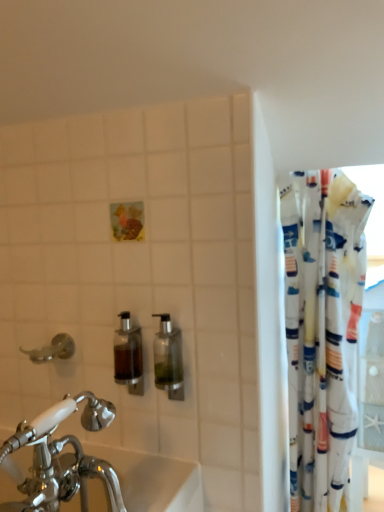
The width and height of the screenshot is (384, 512). Describe the element at coordinates (62, 458) in the screenshot. I see `chrome metallic faucet at lower left` at that location.

Where is `white fabric curtain at right`? This screenshot has height=512, width=384. white fabric curtain at right is located at coordinates (322, 330).

I want to click on clear glass soap dispenser at center, which is the first soap dispenser in right-to-left order, so click(168, 358).

Identify the location of plumbing fixture below the translucent glass soap dispenser at center, acting as the second soap dispenser starting from the right (from the image's perspective). (53, 349).

From a real-world perspective, relative to translucent glass soap dispenser at center, acting as the second soap dispenser starting from the right, is brushed metal faucet at left vertically above or below?

brushed metal faucet at left is below translucent glass soap dispenser at center, acting as the second soap dispenser starting from the right.

Looking at this image, can you confirm if brushed metal faucet at left is thinner than translucent glass soap dispenser at center, acting as the second soap dispenser starting from the right?

No, brushed metal faucet at left is not thinner than translucent glass soap dispenser at center, acting as the second soap dispenser starting from the right.

Who is smaller, translucent glass soap dispenser at center, the 1th soap dispenser viewed from the left, or chrome metallic faucet at lower left?

translucent glass soap dispenser at center, the 1th soap dispenser viewed from the left, is smaller.

Is translucent glass soap dispenser at center, the 1th soap dispenser viewed from the left, not within chrome metallic faucet at lower left?

Yes, translucent glass soap dispenser at center, the 1th soap dispenser viewed from the left, is located beyond the bounds of chrome metallic faucet at lower left.

Can you confirm if brushed metal faucet at left is wider than chrome metallic faucet at lower left?

No, brushed metal faucet at left is not wider than chrome metallic faucet at lower left.

From the picture: Is brushed metal faucet at left in contact with chrome metallic faucet at lower left?

No, brushed metal faucet at left is not next to chrome metallic faucet at lower left.

Is brushed metal faucet at left positioned in front of chrome metallic faucet at lower left?

That is False.

Find the location of a particular element. This screenshot has width=384, height=512. soap dispenser behind the clear glass soap dispenser at center, arranged as the second soap dispenser when viewed from the left is located at coordinates (128, 355).

Is clear glass soap dispenser at center, which is the first soap dispenser in right-to-left order, wider than translucent glass soap dispenser at center, the 1th soap dispenser viewed from the left?

Correct, the width of clear glass soap dispenser at center, which is the first soap dispenser in right-to-left order, exceeds that of translucent glass soap dispenser at center, the 1th soap dispenser viewed from the left.

Would you consider clear glass soap dispenser at center, which is the first soap dispenser in right-to-left order, to be distant from translucent glass soap dispenser at center, the 1th soap dispenser viewed from the left?

clear glass soap dispenser at center, which is the first soap dispenser in right-to-left order, is actually quite close to translucent glass soap dispenser at center, the 1th soap dispenser viewed from the left.

Which object is further away from the camera, clear glass soap dispenser at center, which is the first soap dispenser in right-to-left order, or translucent glass soap dispenser at center, acting as the second soap dispenser starting from the right?

translucent glass soap dispenser at center, acting as the second soap dispenser starting from the right, is further from the camera.

Which object is positioned more to the left, white fabric curtain at right or translucent glass soap dispenser at center, acting as the second soap dispenser starting from the right?

Positioned to the left is translucent glass soap dispenser at center, acting as the second soap dispenser starting from the right.

From a real-world perspective, is white fabric curtain at right located higher than translucent glass soap dispenser at center, the 1th soap dispenser viewed from the left?

No, from a real-world perspective, white fabric curtain at right is not over translucent glass soap dispenser at center, the 1th soap dispenser viewed from the left

Which of these two, white fabric curtain at right or translucent glass soap dispenser at center, acting as the second soap dispenser starting from the right, stands taller?

Standing taller between the two is white fabric curtain at right.

Can you see white fabric curtain at right touching translucent glass soap dispenser at center, acting as the second soap dispenser starting from the right?

No, white fabric curtain at right is not next to translucent glass soap dispenser at center, acting as the second soap dispenser starting from the right.

How many degrees apart are the facing directions of brushed metal faucet at left and white fabric curtain at right?

They differ by 0.759 degrees in their facing directions.

Considering the relative sizes of brushed metal faucet at left and white fabric curtain at right in the image provided, is brushed metal faucet at left smaller than white fabric curtain at right?

Yes, brushed metal faucet at left is smaller than white fabric curtain at right.

From the image's perspective, between brushed metal faucet at left and white fabric curtain at right, which one is located above?

→ From the image's view, brushed metal faucet at left is above.

Based on their positions, is brushed metal faucet at left located to the left or right of white fabric curtain at right?

From the image, it's evident that brushed metal faucet at left is to the left of white fabric curtain at right.

The width and height of the screenshot is (384, 512). In order to click on soap dispenser that is the 1st object located in front of the white fabric curtain at right in this screenshot , I will do `click(128, 355)`.

Is there a large distance between translucent glass soap dispenser at center, acting as the second soap dispenser starting from the right, and white fabric curtain at right?

Actually, translucent glass soap dispenser at center, acting as the second soap dispenser starting from the right, and white fabric curtain at right are a little close together.

Looking at this image, from the image's perspective, is translucent glass soap dispenser at center, acting as the second soap dispenser starting from the right, located beneath white fabric curtain at right?

No, from the image's perspective, translucent glass soap dispenser at center, acting as the second soap dispenser starting from the right, is not beneath white fabric curtain at right.

Is point (118, 359) more distant than point (359, 240)?

That is False.

Find the location of a particular element. the 1st soap dispenser in front of the brushed metal faucet at left, starting your count from the anchor is located at coordinates (128, 355).

This screenshot has width=384, height=512. In order to click on tap located on the left of translucent glass soap dispenser at center, the 1th soap dispenser viewed from the left in this screenshot , I will do `click(62, 458)`.

Which object lies further to the anchor point brushed metal faucet at left, white fabric curtain at right or clear glass soap dispenser at center, which is the first soap dispenser in right-to-left order?

white fabric curtain at right is positioned further to the anchor brushed metal faucet at left.

From the image, which object appears to be farther from clear glass soap dispenser at center, arranged as the second soap dispenser when viewed from the left, chrome metallic faucet at lower left or brushed metal faucet at left?

brushed metal faucet at left lies further to clear glass soap dispenser at center, arranged as the second soap dispenser when viewed from the left, than the other object.

When comparing their distances from translucent glass soap dispenser at center, acting as the second soap dispenser starting from the right, does brushed metal faucet at left or chrome metallic faucet at lower left seem closer?

The object closer to translucent glass soap dispenser at center, acting as the second soap dispenser starting from the right, is brushed metal faucet at left.

Considering their positions, is translucent glass soap dispenser at center, the 1th soap dispenser viewed from the left, positioned further to chrome metallic faucet at lower left than white fabric curtain at right?

white fabric curtain at right lies further to chrome metallic faucet at lower left than the other object.

Based on their spatial positions, is white fabric curtain at right or brushed metal faucet at left closer to chrome metallic faucet at lower left?

Among the two, brushed metal faucet at left is located nearer to chrome metallic faucet at lower left.

Estimate the real-world distances between objects in this image. Which object is further from translucent glass soap dispenser at center, acting as the second soap dispenser starting from the right, brushed metal faucet at left or white fabric curtain at right?

white fabric curtain at right.

Estimate the real-world distances between objects in this image. Which object is further from clear glass soap dispenser at center, arranged as the second soap dispenser when viewed from the left, brushed metal faucet at left or translucent glass soap dispenser at center, the 1th soap dispenser viewed from the left?

brushed metal faucet at left is further to clear glass soap dispenser at center, arranged as the second soap dispenser when viewed from the left.

From the image, which object appears to be nearer to chrome metallic faucet at lower left, clear glass soap dispenser at center, which is the first soap dispenser in right-to-left order, or white fabric curtain at right?

The object closer to chrome metallic faucet at lower left is clear glass soap dispenser at center, which is the first soap dispenser in right-to-left order.

Locate an element on the screen. tap between brushed metal faucet at left and white fabric curtain at right is located at coordinates (62, 458).

Identify the location of soap dispenser between translucent glass soap dispenser at center, the 1th soap dispenser viewed from the left, and white fabric curtain at right. (168, 358).

Find the location of a particular element. soap dispenser situated between brushed metal faucet at left and clear glass soap dispenser at center, which is the first soap dispenser in right-to-left order, from left to right is located at coordinates (128, 355).

Find the location of a particular element. The height and width of the screenshot is (512, 384). soap dispenser between chrome metallic faucet at lower left and translucent glass soap dispenser at center, acting as the second soap dispenser starting from the right, from front to back is located at coordinates (168, 358).